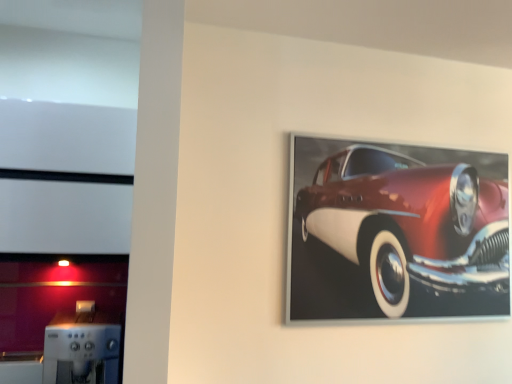
I want to click on shiny red car at upper right, so click(405, 226).

Describe the element at coordinates (405, 226) in the screenshot. I see `shiny red car at upper right` at that location.

What do you see at coordinates (82, 348) in the screenshot? This screenshot has height=384, width=512. I see `sleek silver coffee machine at lower left` at bounding box center [82, 348].

What is the approximate height of sleek silver coffee machine at lower left?

sleek silver coffee machine at lower left is 12.39 inches in height.

Identify the location of sleek silver coffee machine at lower left. This screenshot has height=384, width=512. (82, 348).

I want to click on shiny red car at upper right, so click(405, 226).

Is shiny red car at upper right to the left of sleek silver coffee machine at lower left from the viewer's perspective?

Incorrect, shiny red car at upper right is not on the left side of sleek silver coffee machine at lower left.

Is shiny red car at upper right further to camera compared to sleek silver coffee machine at lower left?

Yes, shiny red car at upper right is further from the camera.

Does point (334, 212) appear closer or farther from the camera than point (58, 383)?

Point (334, 212) appears to be farther away from the viewer than point (58, 383).

From the image's perspective, is shiny red car at upper right above sleek silver coffee machine at lower left?

Yes, from the image's perspective, shiny red car at upper right is over sleek silver coffee machine at lower left.

From a real-world perspective, is shiny red car at upper right positioned above or below sleek silver coffee machine at lower left?

In terms of real-world spatial position, shiny red car at upper right is above sleek silver coffee machine at lower left.

Considering the sizes of shiny red car at upper right and sleek silver coffee machine at lower left in the image, is shiny red car at upper right wider or thinner than sleek silver coffee machine at lower left?

Considering their sizes, shiny red car at upper right looks slimmer than sleek silver coffee machine at lower left.

Considering the sizes of objects shiny red car at upper right and sleek silver coffee machine at lower left in the image provided, who is shorter, shiny red car at upper right or sleek silver coffee machine at lower left?

sleek silver coffee machine at lower left is shorter.

Considering the sizes of objects shiny red car at upper right and sleek silver coffee machine at lower left in the image provided, who is smaller, shiny red car at upper right or sleek silver coffee machine at lower left?

sleek silver coffee machine at lower left is smaller.

From the picture: Is shiny red car at upper right not inside sleek silver coffee machine at lower left?

shiny red car at upper right is positioned outside sleek silver coffee machine at lower left.

Is shiny red car at upper right next to sleek silver coffee machine at lower left and touching it?

They are not placed beside each other.

Is shiny red car at upper right aimed at sleek silver coffee machine at lower left?

No, shiny red car at upper right is not facing towards sleek silver coffee machine at lower left.

Measure the distance between shiny red car at upper right and sleek silver coffee machine at lower left.

shiny red car at upper right is 4.71 feet away from sleek silver coffee machine at lower left.

Locate an element on the screen. The image size is (512, 384). car above the sleek silver coffee machine at lower left (from a real-world perspective) is located at coordinates (405, 226).

Does sleek silver coffee machine at lower left appear on the left side of shiny red car at upper right?

Yes.

Between sleek silver coffee machine at lower left and shiny red car at upper right, which one is positioned in front?

Positioned in front is sleek silver coffee machine at lower left.

Between point (120, 329) and point (421, 269), which one is positioned in front?

Point (120, 329)

From the image's perspective, is sleek silver coffee machine at lower left on shiny red car at upper right?

No, from the image's perspective, sleek silver coffee machine at lower left is not above shiny red car at upper right.

From a real-world perspective, which object rests below the other?

sleek silver coffee machine at lower left, from a real-world perspective.

Which object is wider, sleek silver coffee machine at lower left or shiny red car at upper right?

sleek silver coffee machine at lower left is wider.

Based on the photo, considering the relative sizes of sleek silver coffee machine at lower left and shiny red car at upper right in the image provided, is sleek silver coffee machine at lower left taller than shiny red car at upper right?

No.

Considering the relative sizes of sleek silver coffee machine at lower left and shiny red car at upper right in the image provided, is sleek silver coffee machine at lower left bigger than shiny red car at upper right?

Incorrect, sleek silver coffee machine at lower left is not larger than shiny red car at upper right.

Is shiny red car at upper right located within sleek silver coffee machine at lower left?

No, sleek silver coffee machine at lower left does not contain shiny red car at upper right.

Does sleek silver coffee machine at lower left touch shiny red car at upper right?

No, sleek silver coffee machine at lower left is not touching shiny red car at upper right.

Is sleek silver coffee machine at lower left positioned with its back to shiny red car at upper right?

sleek silver coffee machine at lower left does not have its back to shiny red car at upper right.

Image resolution: width=512 pixels, height=384 pixels. I want to click on car behind the sleek silver coffee machine at lower left, so (x=405, y=226).

The image size is (512, 384). I want to click on car behind the sleek silver coffee machine at lower left, so click(x=405, y=226).

Where is `appliance below the shiny red car at upper right (from the image's perspective)`? appliance below the shiny red car at upper right (from the image's perspective) is located at coordinates (82, 348).